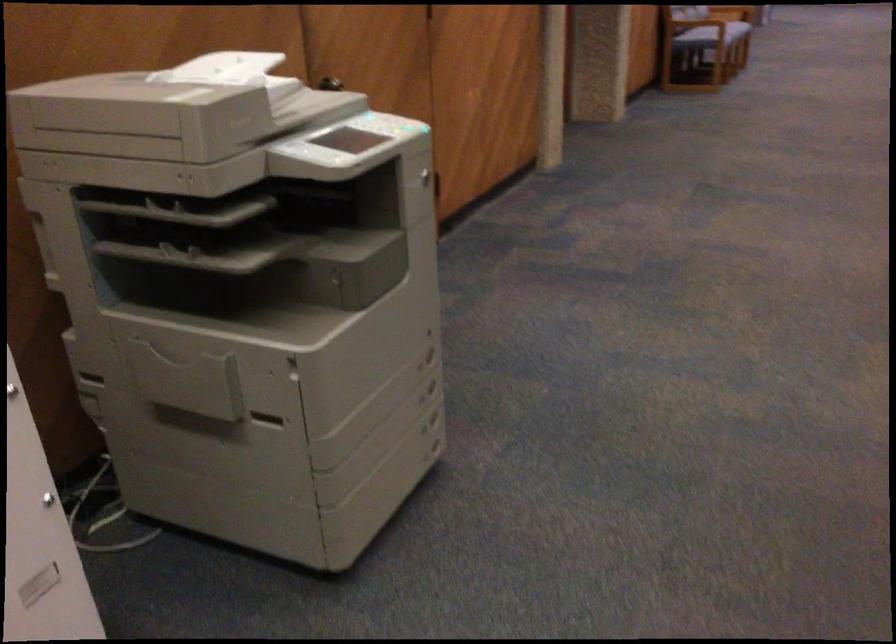
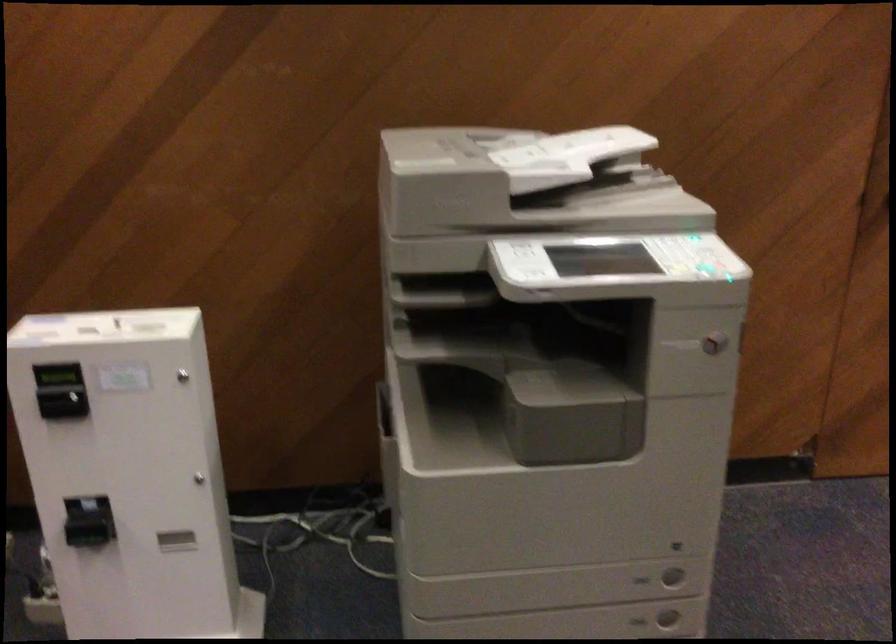
The point at (401,129) is marked in the first image. Where is the corresponding point in the second image?

(698, 266)